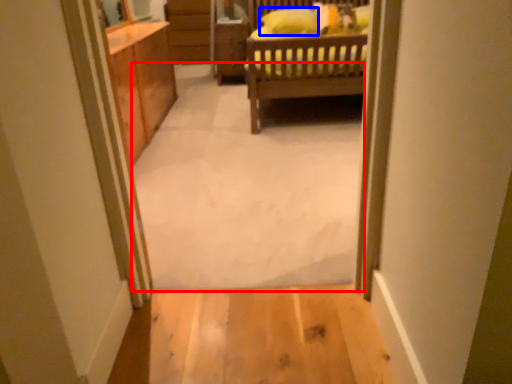
Question: Which point is further to the camera, plain (highlighted by a red box) or pillow (highlighted by a blue box)?

Choices:
 (A) plain
 (B) pillow

Answer: (B)